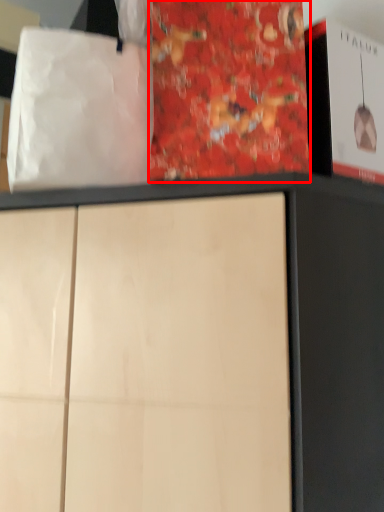
Question: Observing the image, what is the correct spatial positioning of paperback book (annotated by the red box) in reference to tote bag?

Choices:
 (A) right
 (B) left

Answer: (A)